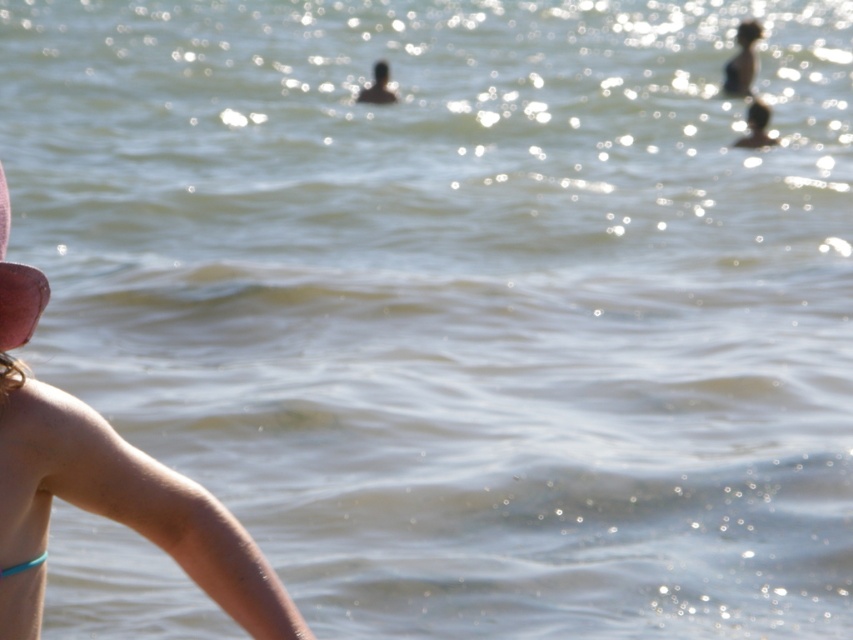
You are standing on the beach and looking at the water. There are two points marked on the image, point (x=207, y=589) and point (x=26, y=292). Which point is closer to you?

Point (x=207, y=589) is closer to you because it is further to the viewer than point (x=26, y=292).

You are a photographer trying to capture the pink fabric hat at left and the tan skin arm at lower left in the same frame. Which object should you adjust your camera to focus on first if you want to ensure both are in focus?

The tan skin arm at lower left is positioned on the right side of pink fabric hat at left. Since they are positioned close to each other horizontally, adjusting focus on either object should keep both in focus as long as the depth of field is sufficient.

You are a photographer trying to capture the pink fabric hat at left and the tan skin arm at lower left in a single shot. Based on their positions, which object should you adjust your camera focus to prioritize if you want the closer object to be sharp?

The tan skin arm at lower left is closer to the camera than the pink fabric hat at left, so you should prioritize focusing on the tan skin arm at lower left to ensure it appears sharp.